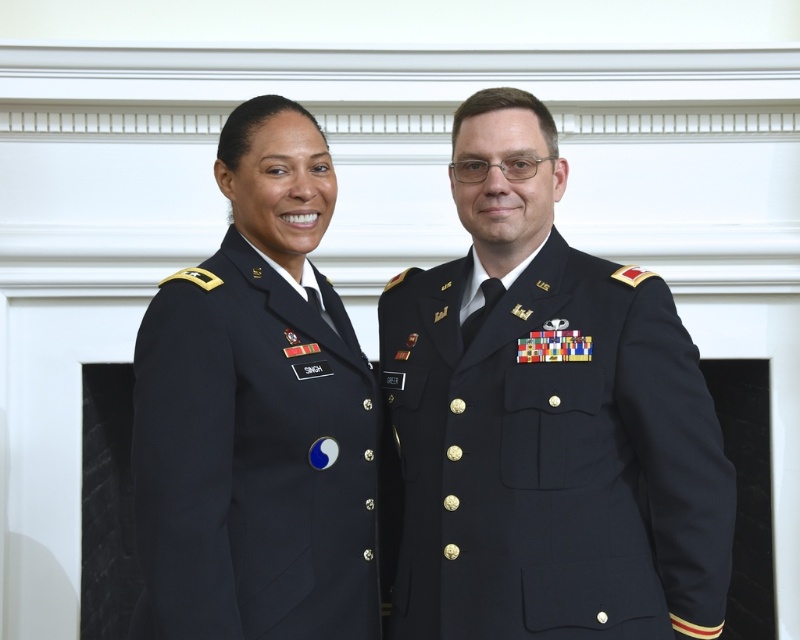
Who is more distant from viewer, (x=430, y=449) or (x=310, y=388)?

Point (x=430, y=449)

Who is positioned more to the left, navy blue uniform at center or navy blue fabric uniform at left?

From the viewer's perspective, navy blue fabric uniform at left appears more on the left side.

Locate an element on the screen. This screenshot has height=640, width=800. navy blue uniform at center is located at coordinates (545, 420).

Can you confirm if navy blue uniform at center is positioned to the right of navy blue wool military uniform at center?

Yes, navy blue uniform at center is to the right of navy blue wool military uniform at center.

Which is below, navy blue uniform at center or navy blue wool military uniform at center?

navy blue wool military uniform at center is below.

Describe the element at coordinates (545, 420) in the screenshot. I see `navy blue uniform at center` at that location.

Find the location of a particular element. The height and width of the screenshot is (640, 800). navy blue uniform at center is located at coordinates (545, 420).

Is navy blue wool military uniform at center wider than navy blue fabric uniform at left?

Indeed, navy blue wool military uniform at center has a greater width compared to navy blue fabric uniform at left.

Can you confirm if navy blue wool military uniform at center is shorter than navy blue fabric uniform at left?

Incorrect, navy blue wool military uniform at center's height does not fall short of navy blue fabric uniform at left's.

You are a GUI agent. You are given a task and a screenshot of the screen. Output one action in this format:
    pyautogui.click(x=<x>, y=<y>)
    Task: Click on the navy blue wool military uniform at center
    
    Given the screenshot: What is the action you would take?
    pyautogui.click(x=552, y=458)

Where is `navy blue wool military uniform at center`? navy blue wool military uniform at center is located at coordinates (552, 458).